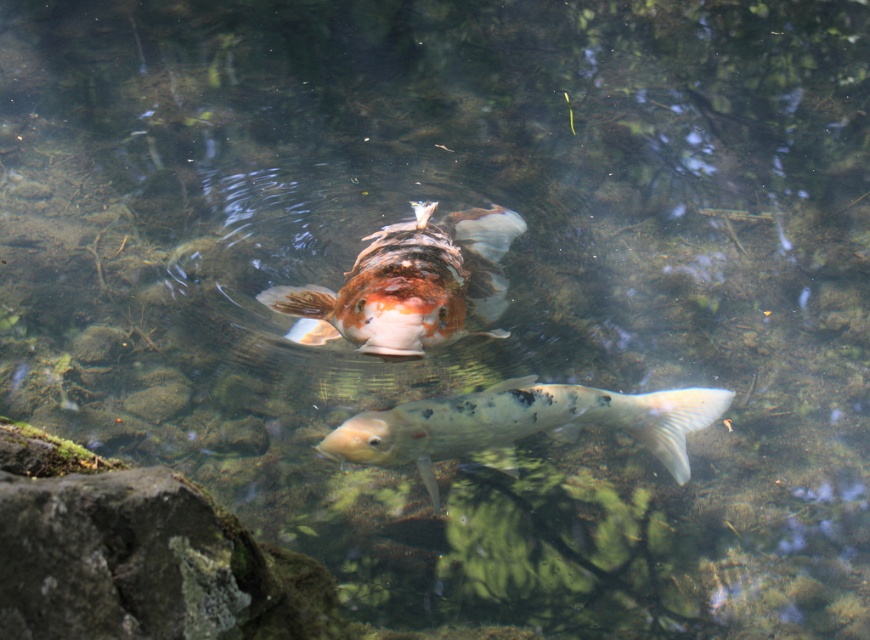
Who is more forward, (295,326) or (385,422)?

Point (385,422)

Can you confirm if shiny orange and white fish at center is taller than speckled white fish at center?

Yes, shiny orange and white fish at center is taller than speckled white fish at center.

The width and height of the screenshot is (870, 640). Find the location of `shiny orange and white fish at center`. shiny orange and white fish at center is located at coordinates (409, 285).